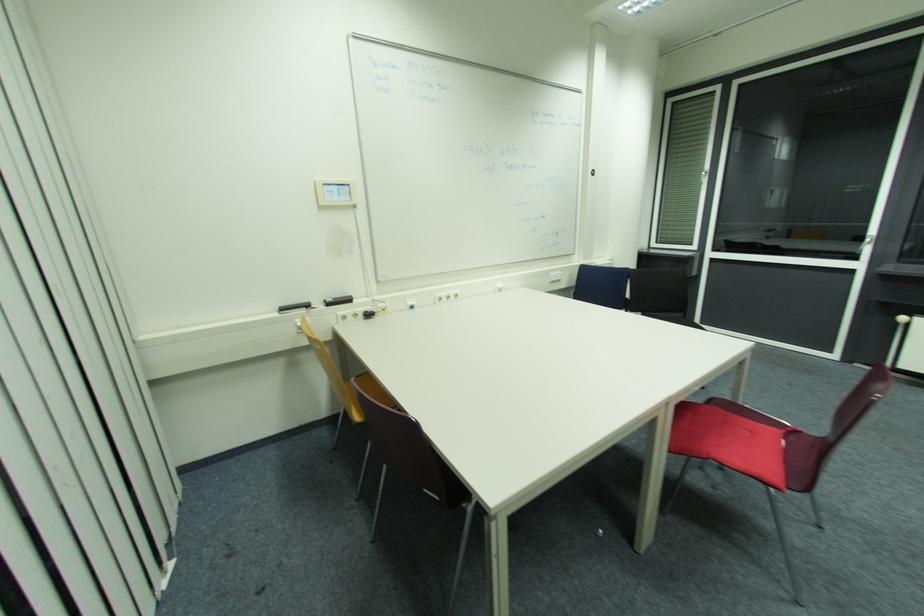
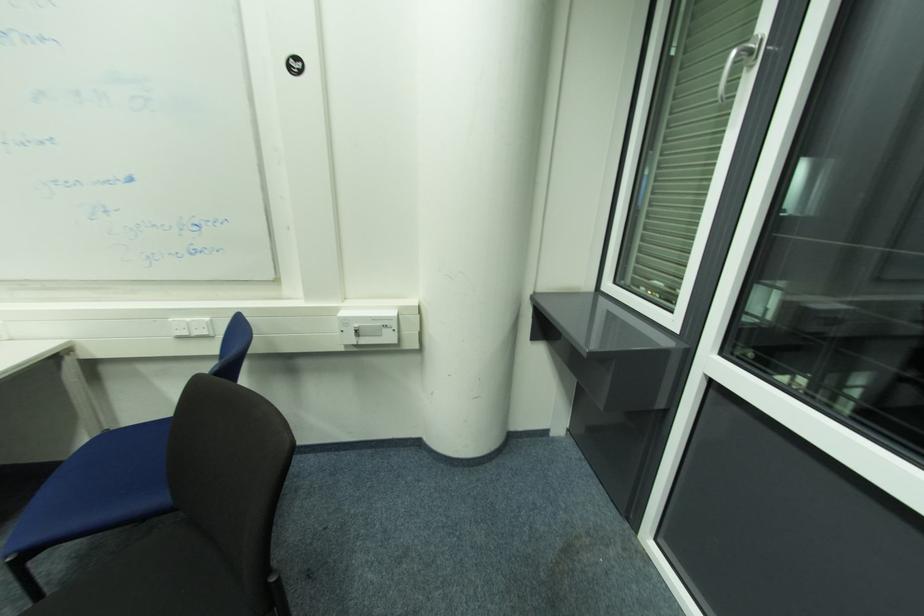
Which direction would the cameraman need to move to produce the second image?

The cameraman moved toward right, forward.